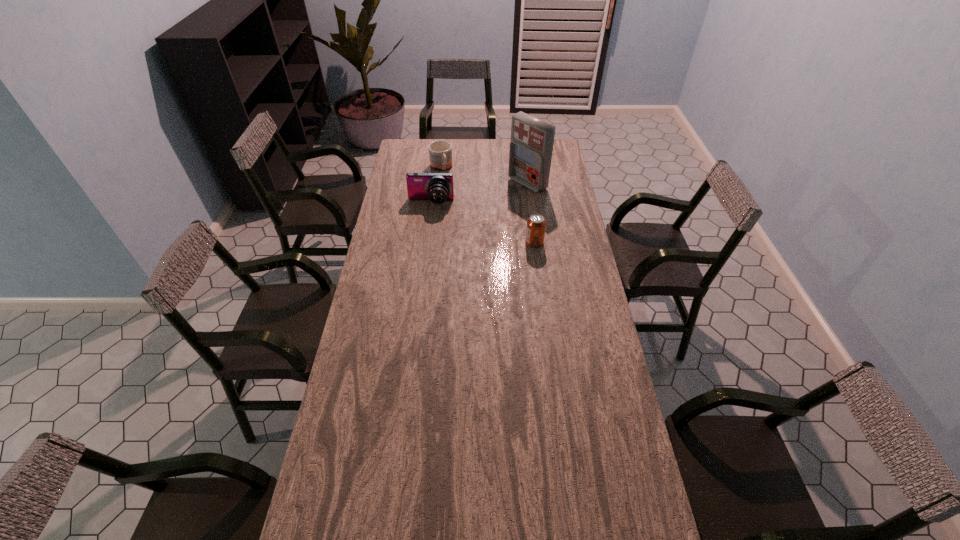
Image resolution: width=960 pixels, height=540 pixels. What are the coordinates of `the third farthest object` in the screenshot? It's located at (437, 187).

At what (x,y) coordinates should I click in order to perform the action: click on can. Please return your answer as a coordinate pair (x, y). The width and height of the screenshot is (960, 540). Looking at the image, I should click on (536, 224).

Where is `mug`? mug is located at coordinates (440, 152).

At what (x,y) coordinates should I click in order to perform the action: click on the tallest object. Please return your answer as a coordinate pair (x, y). Looking at the image, I should click on (530, 154).

Where is `vacant space situated on the front-facing side of the third farthest object`? The image size is (960, 540). vacant space situated on the front-facing side of the third farthest object is located at coordinates (429, 218).

Where is `free space located 0.300m on the back of the nearest object`? Image resolution: width=960 pixels, height=540 pixels. free space located 0.300m on the back of the nearest object is located at coordinates click(x=528, y=197).

The height and width of the screenshot is (540, 960). Identify the location of free location located 0.350m on the side with the handle of the mug. (465, 215).

The width and height of the screenshot is (960, 540). Identify the location of vacant space situated 0.360m on the side with the handle of the mug. (466, 217).

Identify the location of vacant space located on the side with the handle of the mug. (447, 183).

Where is `free spot located 0.110m on the front-facing side of the tallest object`? Image resolution: width=960 pixels, height=540 pixels. free spot located 0.110m on the front-facing side of the tallest object is located at coordinates (499, 200).